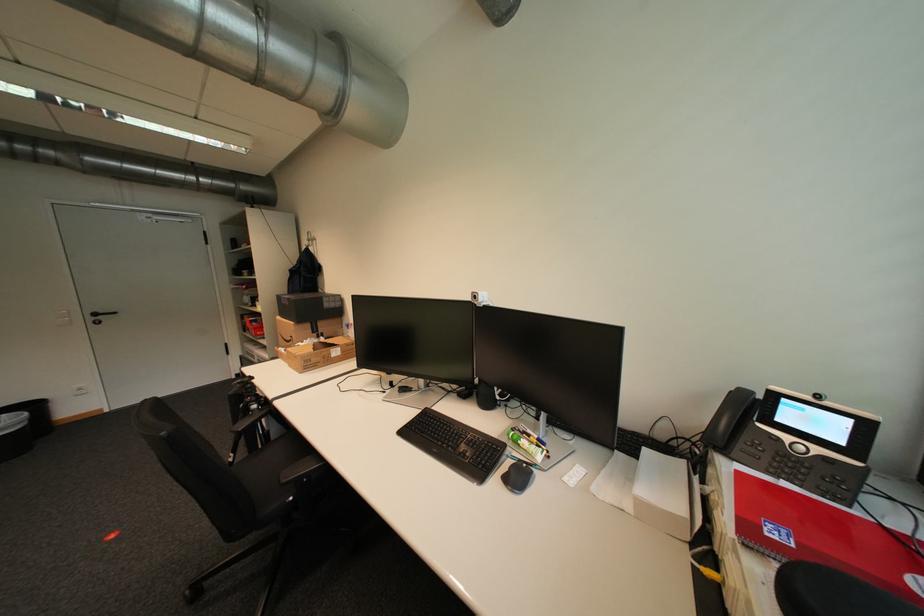
Identify the location of phone button. (796, 440).